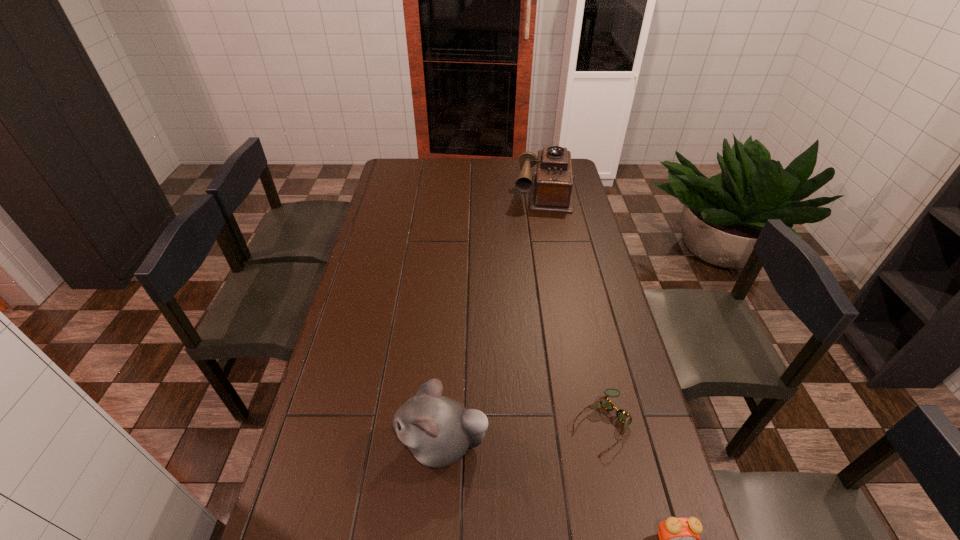
Identify the location of vacant space located 0.100m on the horn of the farthest object. This screenshot has height=540, width=960. (543, 227).

This screenshot has height=540, width=960. In order to click on vacant space located on the horn of the farthest object in this screenshot , I will do `click(543, 228)`.

Where is `object that is at the far edge`? This screenshot has width=960, height=540. object that is at the far edge is located at coordinates (551, 185).

The height and width of the screenshot is (540, 960). Identify the location of spectacles at the right edge. (622, 415).

Where is `phonograph_record present at the right edge`? phonograph_record present at the right edge is located at coordinates (551, 185).

The image size is (960, 540). I want to click on object at the far right corner, so click(551, 185).

The image size is (960, 540). In the image, there is a desktop. What are the coordinates of `blank space at the left edge` in the screenshot? It's located at (305, 459).

Locate an element on the screen. Image resolution: width=960 pixels, height=540 pixels. blank space at the right edge of the desktop is located at coordinates (654, 490).

Identify the location of free space at the far left corner. The height and width of the screenshot is (540, 960). (415, 170).

The width and height of the screenshot is (960, 540). I want to click on unoccupied position between the spectacles and the hamster, so click(x=521, y=434).